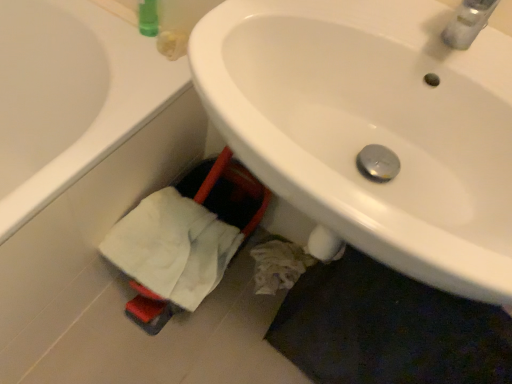
Question: From a real-world perspective, is white cotton bath towel at lower left beneath white matte bathtub at lower left?

Choices:
 (A) no
 (B) yes

Answer: (A)

Question: Does white cotton bath towel at lower left have a lesser height compared to white matte bathtub at lower left?

Choices:
 (A) yes
 (B) no

Answer: (A)

Question: Considering the relative sizes of white cotton bath towel at lower left and white matte bathtub at lower left in the image provided, is white cotton bath towel at lower left smaller than white matte bathtub at lower left?

Choices:
 (A) no
 (B) yes

Answer: (B)

Question: Does white cotton bath towel at lower left lie in front of white matte bathtub at lower left?

Choices:
 (A) yes
 (B) no

Answer: (B)

Question: Considering the relative sizes of white cotton bath towel at lower left and white matte bathtub at lower left in the image provided, is white cotton bath towel at lower left taller than white matte bathtub at lower left?

Choices:
 (A) yes
 (B) no

Answer: (B)

Question: Considering the positions of white glossy sink at center and white matte bathtub at lower left in the image, is white glossy sink at center wider or thinner than white matte bathtub at lower left?

Choices:
 (A) thin
 (B) wide

Answer: (A)

Question: Is white glossy sink at center inside or outside of white matte bathtub at lower left?

Choices:
 (A) inside
 (B) outside

Answer: (B)

Question: In terms of height, does white glossy sink at center look taller or shorter compared to white matte bathtub at lower left?

Choices:
 (A) tall
 (B) short

Answer: (A)

Question: Based on their sizes in the image, would you say white glossy sink at center is bigger or smaller than white matte bathtub at lower left?

Choices:
 (A) small
 (B) big

Answer: (A)

Question: Considering the positions of white glossy sink at center and white cotton bath towel at lower left in the image, is white glossy sink at center taller or shorter than white cotton bath towel at lower left?

Choices:
 (A) tall
 (B) short

Answer: (A)

Question: From the image's perspective, relative to white cotton bath towel at lower left, is white glossy sink at center above or below?

Choices:
 (A) above
 (B) below

Answer: (A)

Question: Is white glossy sink at center bigger or smaller than white cotton bath towel at lower left?

Choices:
 (A) big
 (B) small

Answer: (A)

Question: Considering their positions, is white glossy sink at center located in front of or behind white cotton bath towel at lower left?

Choices:
 (A) front
 (B) behind

Answer: (A)

Question: Is white cotton bath towel at lower left in front of or behind white matte bathtub at lower left in the image?

Choices:
 (A) front
 (B) behind

Answer: (B)

Question: From a real-world perspective, is white cotton bath towel at lower left physically located above or below white matte bathtub at lower left?

Choices:
 (A) above
 (B) below

Answer: (A)